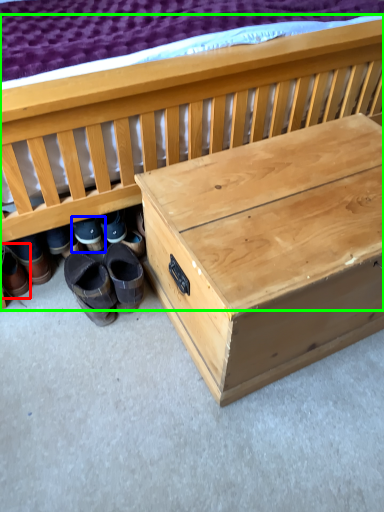
Question: Which object is the farthest from footwear (highlighted by a red box)? Choose among these: footwear (highlighted by a blue box) or furniture (highlighted by a green box).

Choices:
 (A) footwear
 (B) furniture

Answer: (B)